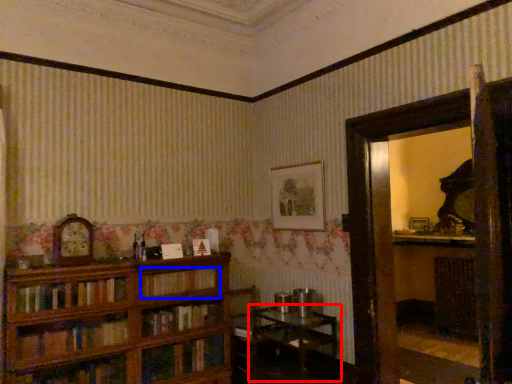
Question: Which object appears farthest to the camera in this image, table (highlighted by a red box) or book (highlighted by a blue box)?

Choices:
 (A) table
 (B) book

Answer: (B)